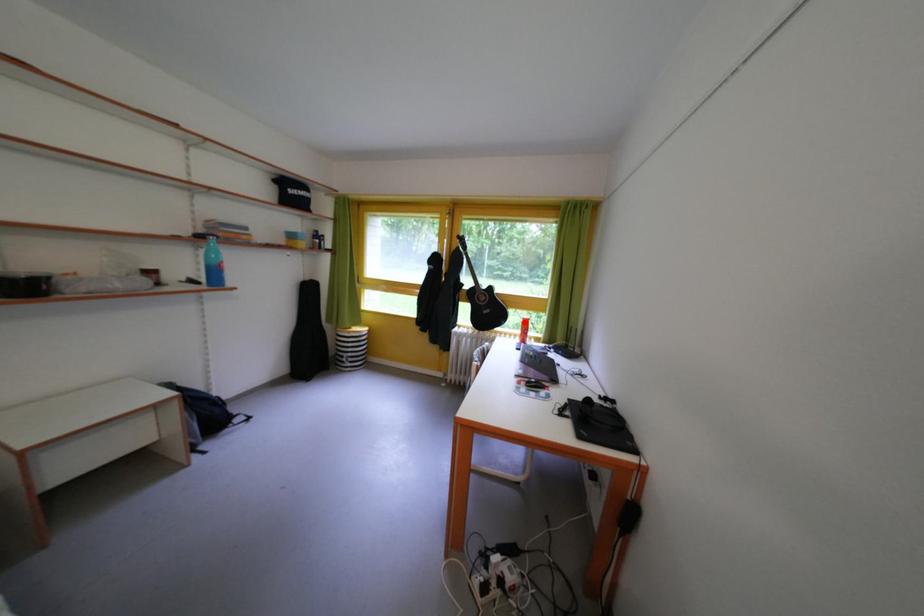
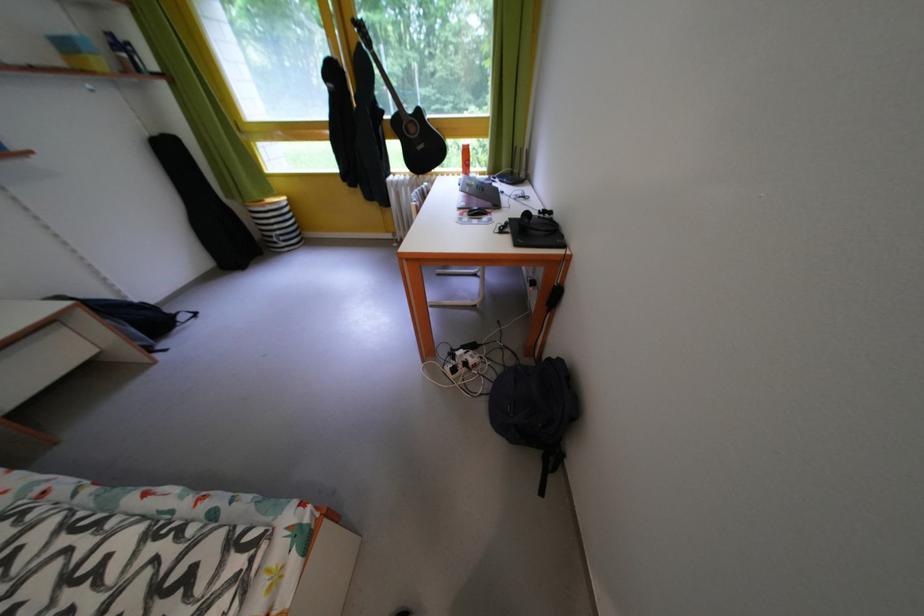
Question: I am providing you with two images of the same scene from different viewpoints. Given a red point in image1, look at the same physical point in image2. Is it:

Choices:
 (A) Closer to the viewpoint
 (B) Farther from the viewpoint

Answer: (A)